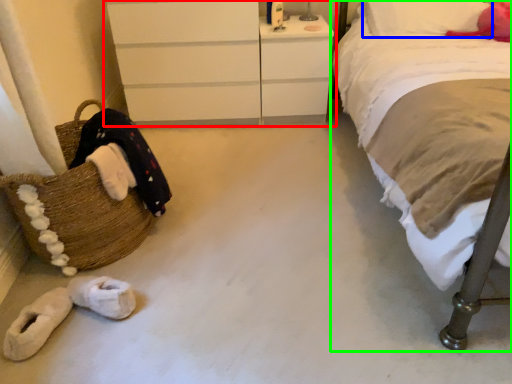
Question: Based on their relative distances, which object is farther from chest of drawers (highlighted by a red box)? Choose from pillow (highlighted by a blue box) and bed (highlighted by a green box).

Choices:
 (A) pillow
 (B) bed

Answer: (B)